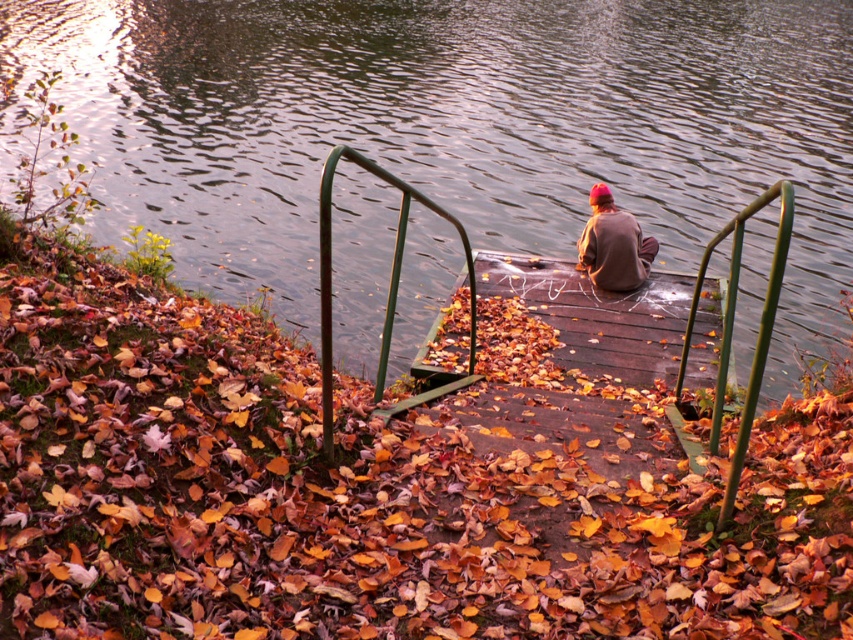
Identify the location of green metal rail at center. The height and width of the screenshot is (640, 853). (387, 298).

From the picture: Can you confirm if green metal rail at center is positioned to the right of brown matte jacket at center?

In fact, green metal rail at center is to the left of brown matte jacket at center.

Does point (399, 259) lie behind point (619, 243)?

No, it is not.

Where is `green metal rail at center`? This screenshot has width=853, height=640. green metal rail at center is located at coordinates (387, 298).

Is point (186, 122) behind point (662, 449)?

That is True.

Who is positioned more to the right, glossy water at upper center or wooden dock at center?

From the viewer's perspective, glossy water at upper center appears more on the right side.

Measure the distance between point [376,51] and camera.

The distance of point [376,51] from camera is 26.57 meters.

You are a GUI agent. You are given a task and a screenshot of the screen. Output one action in this format:
    pyautogui.click(x=<x>, y=<y>)
    Task: Click on the glossy water at upper center
    The height and width of the screenshot is (640, 853).
    Given the screenshot: What is the action you would take?
    pyautogui.click(x=456, y=128)

Between glossy water at upper center and brown matte jacket at center, which one appears on the left side from the viewer's perspective?

brown matte jacket at center

Which is more to the right, glossy water at upper center or brown matte jacket at center?

From the viewer's perspective, glossy water at upper center appears more on the right side.

Is point (202, 88) closer to camera compared to point (612, 241)?

No, it is behind (612, 241).

The image size is (853, 640). In order to click on glossy water at upper center in this screenshot , I will do `click(456, 128)`.